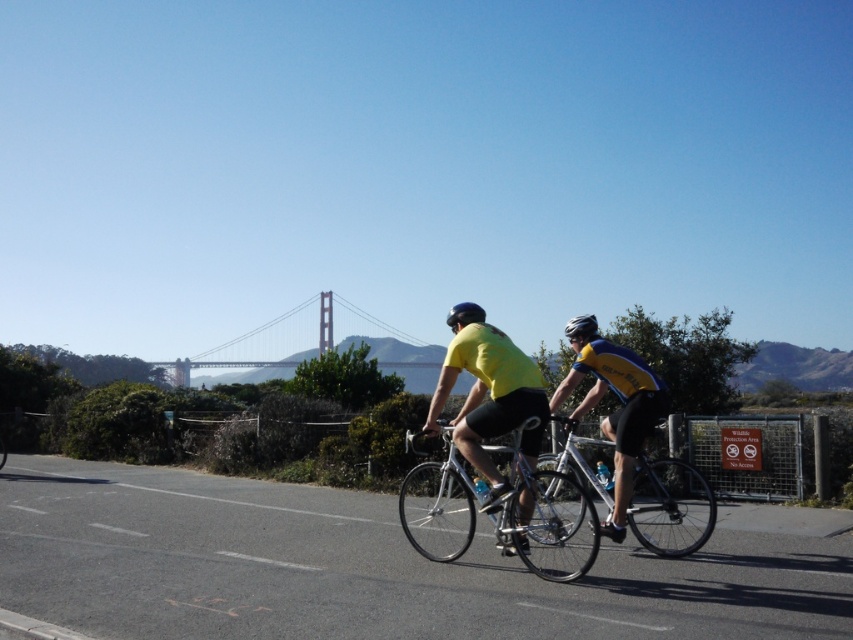
Is yellow matte shirt at center taller than black matte helmet at center?

No.

Based on the photo, is yellow matte shirt at center thinner than black matte helmet at center?

Indeed, yellow matte shirt at center has a lesser width compared to black matte helmet at center.

The width and height of the screenshot is (853, 640). What do you see at coordinates (490, 397) in the screenshot? I see `yellow matte shirt at center` at bounding box center [490, 397].

Find the location of a particular element. This screenshot has width=853, height=640. yellow matte shirt at center is located at coordinates (490, 397).

Between shiny silver bicycle at center and silver metallic bicycle at center, which one is positioned lower?

silver metallic bicycle at center is lower down.

Is shiny silver bicycle at center below silver metallic bicycle at center?

No.

Find the location of `shiny silver bicycle at center`. shiny silver bicycle at center is located at coordinates (547, 520).

This screenshot has width=853, height=640. I want to click on shiny silver bicycle at center, so click(x=547, y=520).

Is yellow matte shirt at center taller than silver metallic bicycle at center?

Incorrect, yellow matte shirt at center's height is not larger of silver metallic bicycle at center's.

Find the location of a particular element. yellow matte shirt at center is located at coordinates (490, 397).